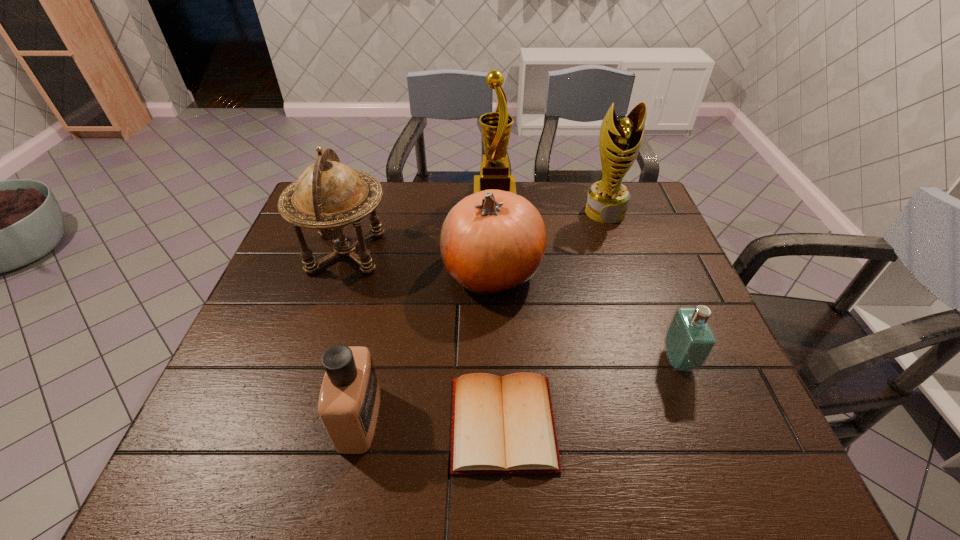
Where is `free region located 0.060m on the front-facing side of the left award`? The height and width of the screenshot is (540, 960). free region located 0.060m on the front-facing side of the left award is located at coordinates (456, 194).

This screenshot has height=540, width=960. I want to click on free space located on the front-facing side of the left award, so click(368, 194).

At what (x,y) coordinates should I click in order to perform the action: click on vacant area situated on the front-facing side of the right award. Please return your answer as a coordinate pair (x, y). This screenshot has width=960, height=540. Looking at the image, I should click on (619, 253).

Image resolution: width=960 pixels, height=540 pixels. Identify the location of vacant space located on the front-facing side of the globe. (482, 252).

Where is `free space located 0.060m on the right of the pumpkin`? The image size is (960, 540). free space located 0.060m on the right of the pumpkin is located at coordinates (564, 271).

What are the coordinates of `vacant region located on the front label of the taller perfume` in the screenshot? It's located at (534, 418).

Where is `free point located 0.240m on the front label of the sixth tallest object`? Image resolution: width=960 pixels, height=540 pixels. free point located 0.240m on the front label of the sixth tallest object is located at coordinates (560, 360).

This screenshot has height=540, width=960. I want to click on blank area located 0.230m on the front label of the sixth tallest object, so click(564, 360).

This screenshot has width=960, height=540. In order to click on free space located 0.170m on the front label of the sixth tallest object in this screenshot , I will do `click(590, 360)`.

You are a GUI agent. You are given a task and a screenshot of the screen. Output one action in this format:
    pyautogui.click(x=<x>, y=<y>)
    Task: Click on the free location located on the right of the Bible
    The image size is (960, 540).
    Given the screenshot: What is the action you would take?
    pyautogui.click(x=634, y=423)